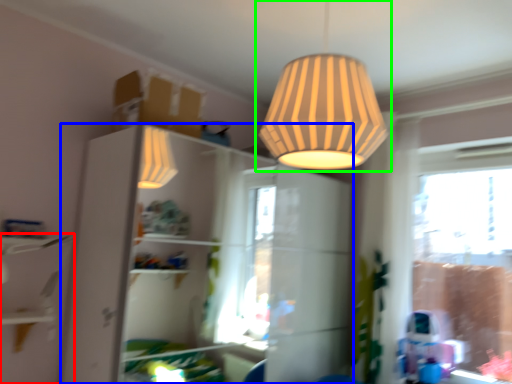
Question: Considering the real-world distances, which object is farthest from shelf (highlighted by a red box)? dresser (highlighted by a blue box) or lamp (highlighted by a green box)?

Choices:
 (A) dresser
 (B) lamp

Answer: (A)